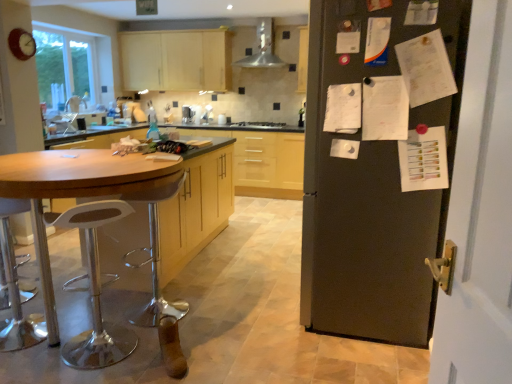
The height and width of the screenshot is (384, 512). Describe the element at coordinates (170, 226) in the screenshot. I see `wooden table at left` at that location.

Where is `metallic silver range hood at upper center`? The height and width of the screenshot is (384, 512). metallic silver range hood at upper center is located at coordinates (262, 49).

What do you see at coordinates (156, 261) in the screenshot?
I see `metallic silver bar stool at left, the second bar stool viewed from the front` at bounding box center [156, 261].

This screenshot has width=512, height=384. Identify the location of yellow wood cabinets at center, which is the 2th cabinetry from top to bottom. (263, 160).

At what (x,y) coordinates should I click in order to perform the action: click on satin silver stove at center. Please return your answer as a coordinate pair (x, y). Looking at the image, I should click on (259, 125).

At what (x,y) coordinates should I click in order to perform the action: click on white plastic bar stool at left, the first bar stool in the front-to-back sequence. Please return your answer as a coordinate pair (x, y). This screenshot has width=512, height=384. Looking at the image, I should click on (94, 290).

The width and height of the screenshot is (512, 384). What do you see at coordinates (94, 290) in the screenshot?
I see `white plastic bar stool at left, the second bar stool in the back-to-front sequence` at bounding box center [94, 290].

I want to click on wooden table at left, so click(x=170, y=226).

Between yellow wood cabinets at center, which is the 2th cabinetry from top to bottom, and metallic silver range hood at upper center, which one appears on the right side from the viewer's perspective?

metallic silver range hood at upper center.

Is yellow wood cabinets at center, the 1th cabinetry positioned from the bottom, thinner than metallic silver range hood at upper center?

No, yellow wood cabinets at center, the 1th cabinetry positioned from the bottom, is not thinner than metallic silver range hood at upper center.

Based on the photo, which point is more distant from viewer, (265, 142) or (279, 59)?

The point (265, 142) is behind.

Looking at this image, considering the sizes of yellow wood cabinets at center, the 1th cabinetry positioned from the bottom, and metallic silver range hood at upper center in the image, is yellow wood cabinets at center, the 1th cabinetry positioned from the bottom, bigger or smaller than metallic silver range hood at upper center?

yellow wood cabinets at center, the 1th cabinetry positioned from the bottom, is bigger than metallic silver range hood at upper center.

Looking at this image, from a real-world perspective, which is physically below, matte wood cabinets at upper center, which is the 2th cabinetry in bottom-to-top order, or wooden table at left?

wooden table at left is physically lower.

Considering the positions of objects matte wood cabinets at upper center, which is the 2th cabinetry in bottom-to-top order, and wooden table at left in the image provided, who is behind, matte wood cabinets at upper center, which is the 2th cabinetry in bottom-to-top order, or wooden table at left?

matte wood cabinets at upper center, which is the 2th cabinetry in bottom-to-top order, is more distant.

In terms of size, does yellow wood cabinets at center, which is the 2th cabinetry from top to bottom, appear bigger or smaller than matte wood cabinets at upper center, which is the 2th cabinetry in bottom-to-top order?

In the image, yellow wood cabinets at center, which is the 2th cabinetry from top to bottom, appears to be larger than matte wood cabinets at upper center, which is the 2th cabinetry in bottom-to-top order.

Does point (259, 160) come in front of point (144, 56)?

Yes, it is in front of point (144, 56).

Is yellow wood cabinets at center, which is the 2th cabinetry from top to bottom, oriented away from matte wood cabinets at upper center, which is the 2th cabinetry in bottom-to-top order?

yellow wood cabinets at center, which is the 2th cabinetry from top to bottom, does not have its back to matte wood cabinets at upper center, which is the 2th cabinetry in bottom-to-top order.

Locate an element on the screen. The image size is (512, 384). cabinetry below the matte wood cabinets at upper center, which ranks as the first cabinetry in top-to-bottom order (from the image's perspective) is located at coordinates (263, 160).

In the scene shown: Who is bigger, metallic silver bar stool at left, placed as the 1th bar stool when sorted from back to front, or metallic silver range hood at upper center?

With larger size is metallic silver range hood at upper center.

Would you say metallic silver range hood at upper center is part of metallic silver bar stool at left, the second bar stool viewed from the front,'s contents?

Actually, metallic silver range hood at upper center is outside metallic silver bar stool at left, the second bar stool viewed from the front.

Does metallic silver bar stool at left, placed as the 1th bar stool when sorted from back to front, lie in front of metallic silver range hood at upper center?

Yes, the depth of metallic silver bar stool at left, placed as the 1th bar stool when sorted from back to front, is less than that of metallic silver range hood at upper center.

Can you see metallic silver bar stool at left, placed as the 1th bar stool when sorted from back to front, touching metallic silver range hood at upper center?

No, metallic silver bar stool at left, placed as the 1th bar stool when sorted from back to front, is not making contact with metallic silver range hood at upper center.

Considering their positions, is matte black refrigerator at right located in front of or behind metallic silver bar stool at left, placed as the 1th bar stool when sorted from back to front?

In the image, matte black refrigerator at right appears in front of metallic silver bar stool at left, placed as the 1th bar stool when sorted from back to front.

Between matte black refrigerator at right and metallic silver bar stool at left, placed as the 1th bar stool when sorted from back to front, which one has smaller width?

metallic silver bar stool at left, placed as the 1th bar stool when sorted from back to front, is thinner.

Consider the image. Are matte black refrigerator at right and metallic silver bar stool at left, placed as the 1th bar stool when sorted from back to front, far apart?

matte black refrigerator at right is far away from metallic silver bar stool at left, placed as the 1th bar stool when sorted from back to front.

Is matte black refrigerator at right not within metallic silver bar stool at left, placed as the 1th bar stool when sorted from back to front?

Yes, matte black refrigerator at right is not within metallic silver bar stool at left, placed as the 1th bar stool when sorted from back to front.

In the scene shown: Between matte black refrigerator at right and satin silver stove at center, which one appears on the right side from the viewer's perspective?

matte black refrigerator at right is more to the right.

Does point (308, 276) come closer to viewer compared to point (253, 128)?

Yes, point (308, 276) is closer to viewer.

Can you tell me how much matte black refrigerator at right and satin silver stove at center differ in facing direction?

matte black refrigerator at right and satin silver stove at center are facing 88.5 degrees away from each other.

Considering the relative sizes of matte black refrigerator at right and satin silver stove at center in the image provided, is matte black refrigerator at right wider than satin silver stove at center?

Correct, the width of matte black refrigerator at right exceeds that of satin silver stove at center.

Can you confirm if satin silver stove at center is positioned to the left of matte wood cabinets at upper center, which ranks as the first cabinetry in top-to-bottom order?

No, satin silver stove at center is not to the left of matte wood cabinets at upper center, which ranks as the first cabinetry in top-to-bottom order.

Does satin silver stove at center have a lesser width compared to matte wood cabinets at upper center, which ranks as the first cabinetry in top-to-bottom order?

No.

Is there a large distance between satin silver stove at center and matte wood cabinets at upper center, which ranks as the first cabinetry in top-to-bottom order?

satin silver stove at center is far away from matte wood cabinets at upper center, which ranks as the first cabinetry in top-to-bottom order.

Is point (249, 128) closer or farther from the camera than point (144, 62)?

Point (249, 128) is closer to the camera than point (144, 62).

From a real-world perspective, starting from the metallic silver range hood at upper center, which cabinetry is the 2nd one below it? Please provide its 2D coordinates.

[(263, 160)]

Find the location of a particular element. Image resolution: width=512 pixels, height=384 pixels. cabinetry that is above the wooden table at left (from a real-world perspective) is located at coordinates (176, 60).

When comparing their distances from metallic silver bar stool at left, the second bar stool viewed from the front, does metallic clock at upper left or matte black refrigerator at right seem further?

metallic clock at upper left lies further to metallic silver bar stool at left, the second bar stool viewed from the front, than the other object.

Based on their spatial positions, is yellow wood cabinets at center, which is the 2th cabinetry from top to bottom, or metallic clock at upper left closer to metallic silver bar stool at left, placed as the 1th bar stool when sorted from back to front?

metallic clock at upper left is closer to metallic silver bar stool at left, placed as the 1th bar stool when sorted from back to front.

Estimate the real-world distances between objects in this image. Which object is closer to white plastic bar stool at left, the first bar stool in the front-to-back sequence, yellow wood cabinets at center, the 1th cabinetry positioned from the bottom, or metallic silver range hood at upper center?

yellow wood cabinets at center, the 1th cabinetry positioned from the bottom, lies closer to white plastic bar stool at left, the first bar stool in the front-to-back sequence, than the other object.

Based on their spatial positions, is metallic silver bar stool at left, the second bar stool viewed from the front, or satin silver stove at center closer to wooden table at left?

Among the two, metallic silver bar stool at left, the second bar stool viewed from the front, is located nearer to wooden table at left.

When comparing their distances from matte wood cabinets at upper center, which is the 2th cabinetry in bottom-to-top order, does wooden table at left or yellow wood cabinets at center, the 1th cabinetry positioned from the bottom, seem closer?

yellow wood cabinets at center, the 1th cabinetry positioned from the bottom, is closer to matte wood cabinets at upper center, which is the 2th cabinetry in bottom-to-top order.

Which object lies further to the anchor point metallic silver range hood at upper center, yellow wood cabinets at center, the 1th cabinetry positioned from the bottom, or wooden table at left?

wooden table at left is positioned further to the anchor metallic silver range hood at upper center.

Considering their positions, is metallic silver range hood at upper center positioned closer to satin silver stove at center than matte wood cabinets at upper center, which is the 2th cabinetry in bottom-to-top order?

Among the two, metallic silver range hood at upper center is located nearer to satin silver stove at center.

Consider the image. Considering their positions, is satin silver stove at center positioned further to matte wood cabinets at upper center, which is the 2th cabinetry in bottom-to-top order, than yellow wood cabinets at center, which is the 2th cabinetry from top to bottom?

Based on the image, satin silver stove at center appears to be further to matte wood cabinets at upper center, which is the 2th cabinetry in bottom-to-top order.

This screenshot has height=384, width=512. In order to click on clock between wooden table at left and yellow wood cabinets at center, which is the 2th cabinetry from top to bottom, in the front-back direction in this screenshot , I will do `click(22, 44)`.

You are a GUI agent. You are given a task and a screenshot of the screen. Output one action in this format:
    pyautogui.click(x=<x>, y=<y>)
    Task: Click on the clock between matte black refrigerator at right and metallic silver range hood at upper center along the z-axis
    This screenshot has width=512, height=384.
    Given the screenshot: What is the action you would take?
    pyautogui.click(x=22, y=44)

You are a GUI agent. You are given a task and a screenshot of the screen. Output one action in this format:
    pyautogui.click(x=<x>, y=<y>)
    Task: Click on the cabinetry located between wooden table at left and satin silver stove at center in the depth direction
    This screenshot has width=512, height=384.
    Given the screenshot: What is the action you would take?
    pyautogui.click(x=263, y=160)

Image resolution: width=512 pixels, height=384 pixels. In order to click on stove between metallic clock at upper left and metallic silver range hood at upper center in this screenshot , I will do `click(259, 125)`.